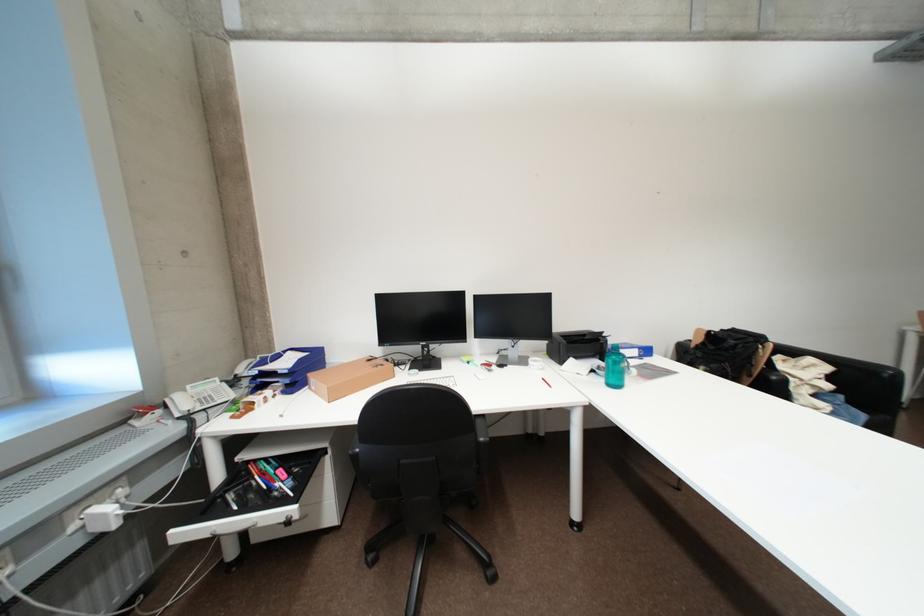
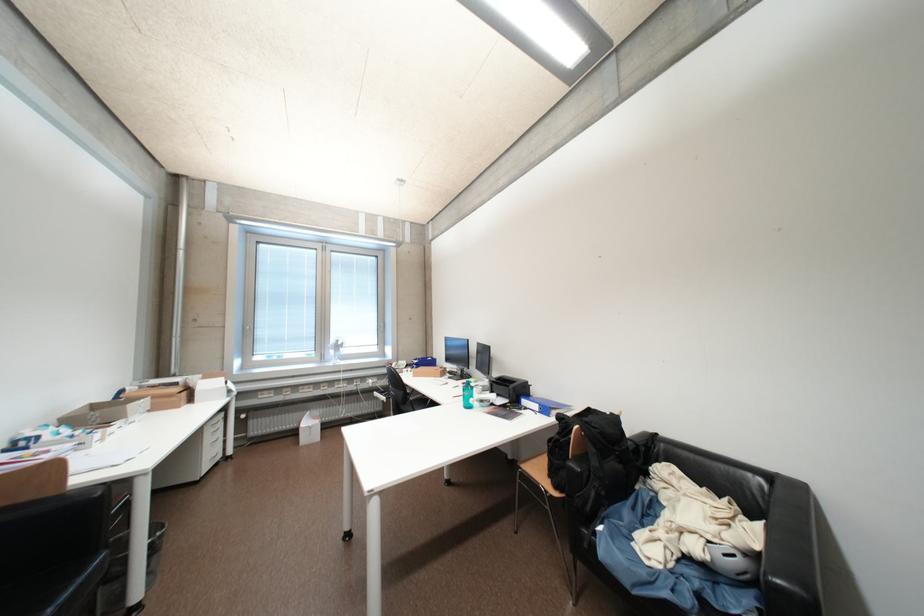
In the second image, find the point that corresponds to point (835, 387) in the first image.

(704, 551)